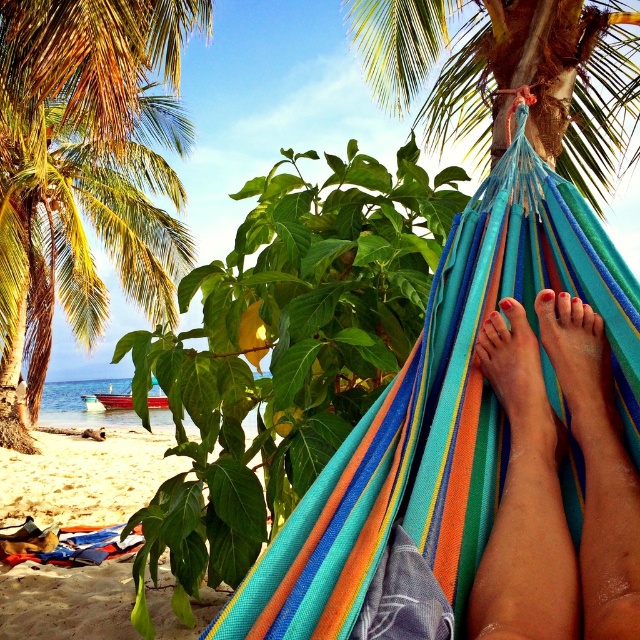
Does multicolored striped hammock at center have a greater width compared to beach sand at lower left?

No, multicolored striped hammock at center is not wider than beach sand at lower left.

Is multicolored striped hammock at center positioned behind beach sand at lower left?

No, multicolored striped hammock at center is in front of beach sand at lower left.

Between point (576, 269) and point (22, 497), which one is positioned in front?

Point (576, 269) is more forward.

This screenshot has height=640, width=640. I want to click on multicolored striped hammock at center, so point(442,413).

Does point (586, 209) come closer to viewer compared to point (563, 378)?

No, it is not.

Is point (468, 566) farther from viewer compared to point (600, 452)?

No, (468, 566) is in front of (600, 452).

At what (x,y) coordinates should I click in order to perform the action: click on multicolored striped hammock at center. Please return your answer as a coordinate pair (x, y). The image size is (640, 640). Looking at the image, I should click on (442, 413).

Can you confirm if multicolored striped hammock at center is smaller than green leafy palm tree at upper left?

Yes.

Which is more to the left, multicolored striped hammock at center or green leafy palm tree at upper left?

Positioned to the left is green leafy palm tree at upper left.

The image size is (640, 640). Find the location of `multicolored striped hammock at center`. multicolored striped hammock at center is located at coordinates (442, 413).